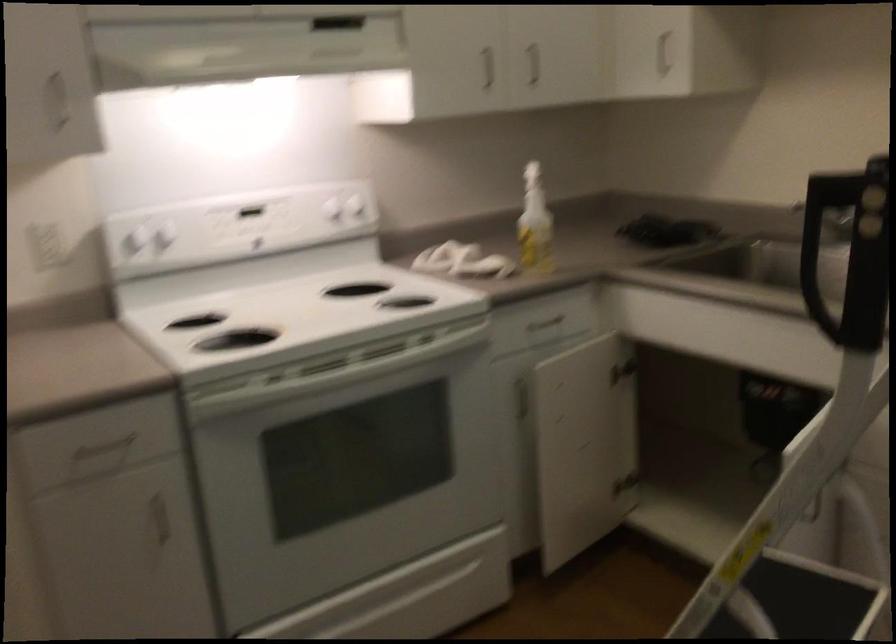
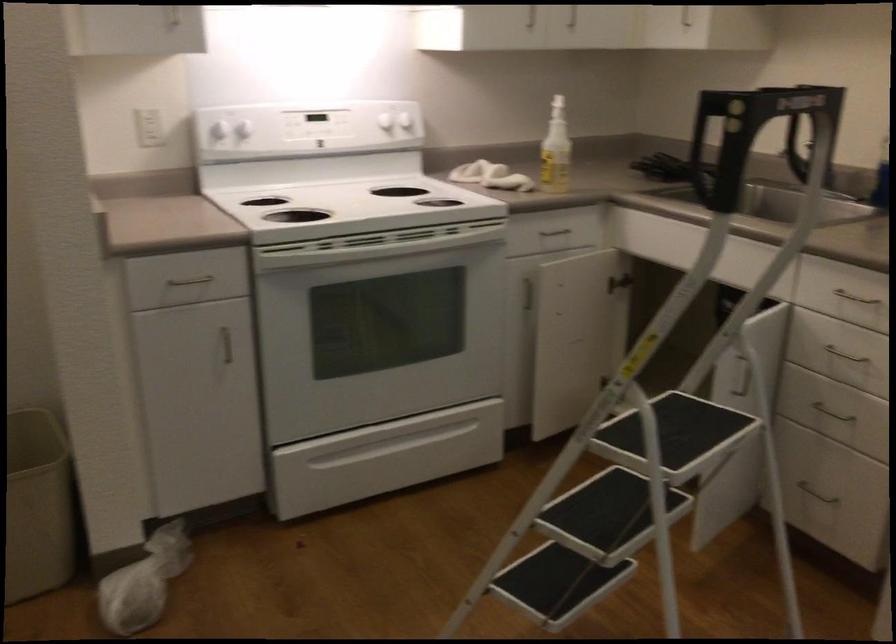
In the second image, find the point that corresponds to point (162, 516) in the first image.

(226, 345)